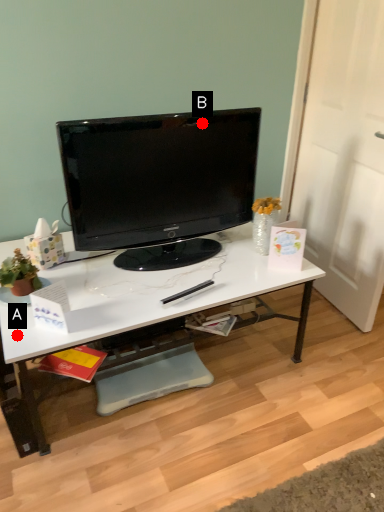
Question: Two points are circled on the image, labeled by A and B beside each circle. Which of the following is the farthest from the observer?

Choices:
 (A) A is further
 (B) B is further

Answer: (B)